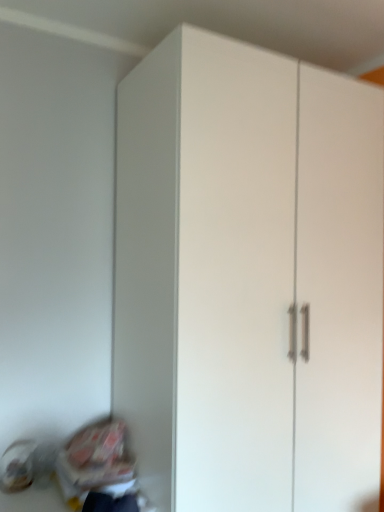
Describe the element at coordinates (245, 273) in the screenshot. I see `white matte cupboard at center` at that location.

In order to click on white matte cupboard at center in this screenshot , I will do `click(245, 273)`.

At what (x,y) coordinates should I click in order to perform the action: click on white matte cupboard at center. Please return your answer as a coordinate pair (x, y). Looking at the image, I should click on [x=245, y=273].